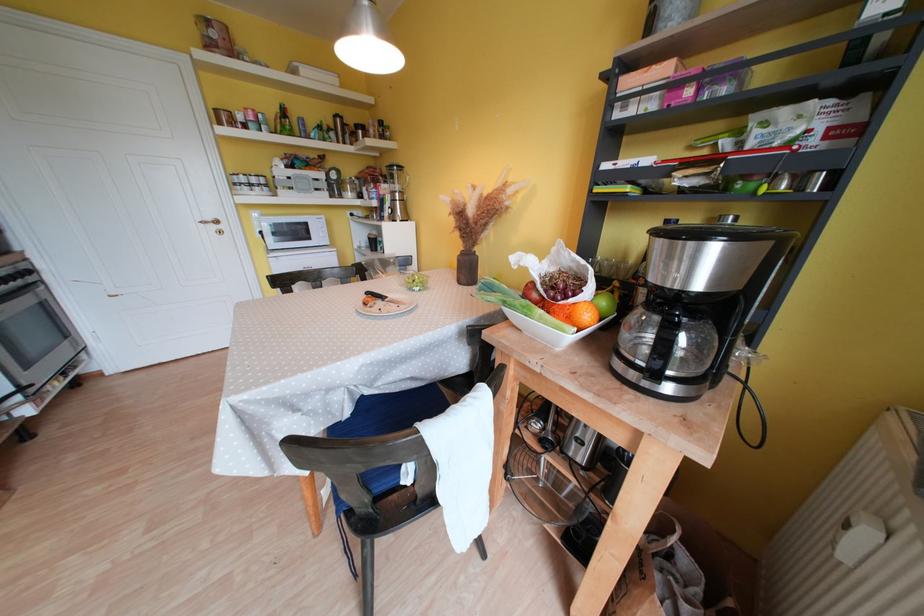
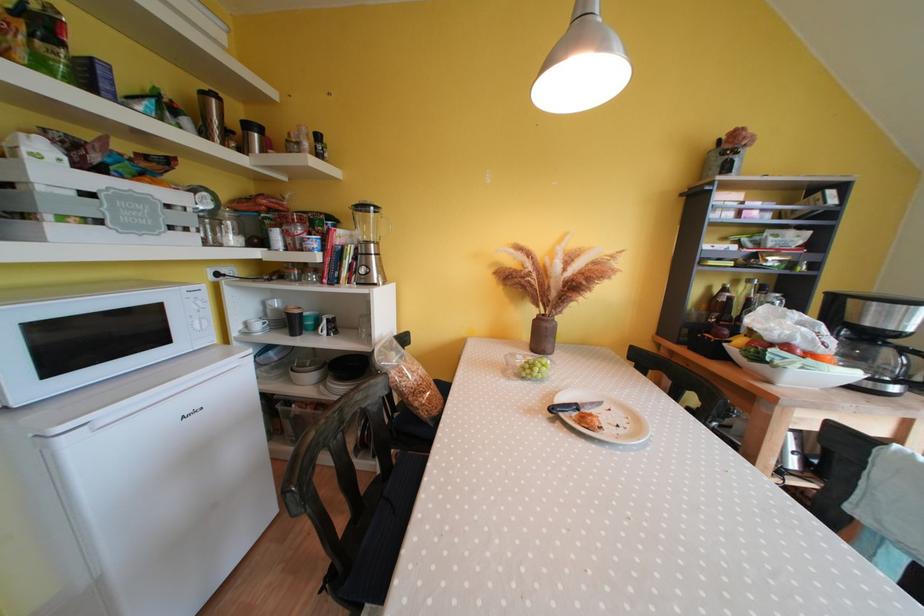
Where in the second image is the point corresponding to point 362,130 from the first image?

(252, 130)